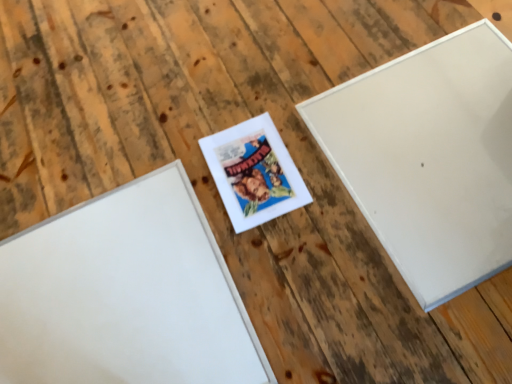
Locate an element on the screen. vacant space behind matte white picture frame at center, positioned as the second picture frame in right-to-left order is located at coordinates (233, 99).